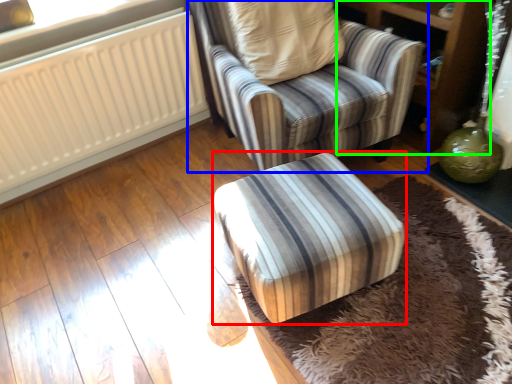
Question: Considering the real-world distances, which object is closest to furniture (highlighted by a red box)? chair (highlighted by a blue box) or dresser (highlighted by a green box).

Choices:
 (A) chair
 (B) dresser

Answer: (A)